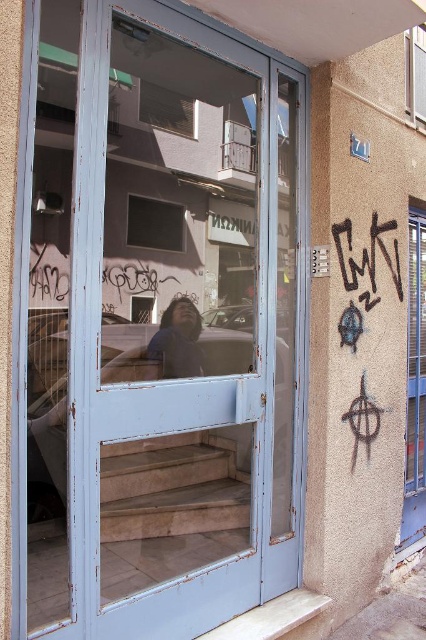
Does black graffiti at upper right have a greater width compared to clear glass window at upper right?

Yes.

Measure the distance from black graffiti at upper right to clear glass window at upper right.

A distance of 38.39 inches exists between black graffiti at upper right and clear glass window at upper right.

Find the location of a particular element. This screenshot has height=640, width=426. black graffiti at upper right is located at coordinates (367, 253).

At what (x,y) coordinates should I click in order to perform the action: click on black graffiti at upper right. Please return your answer as a coordinate pair (x, y). The width and height of the screenshot is (426, 640). Looking at the image, I should click on (367, 253).

Does point (196, 332) lie behind point (166, 224)?

Yes, point (196, 332) is farther from viewer.

Is dark brown hair at center positioned before matte glass window at center?

No, it is behind matte glass window at center.

Is point (158, 330) positioned before point (167, 236)?

No, it is behind (167, 236).

Where is `dark brown hair at center`? dark brown hair at center is located at coordinates (178, 340).

Can you confirm if dark brown hair at center is wider than clear glass window at upper center?

Correct, the width of dark brown hair at center exceeds that of clear glass window at upper center.

Does dark brown hair at center have a lesser height compared to clear glass window at upper center?

No.

Between point (175, 339) and point (186, 131), which one is positioned in front?

Point (186, 131) is more forward.

At what (x,y) coordinates should I click in order to perform the action: click on dark brown hair at center. Please return your answer as a coordinate pair (x, y). Image resolution: width=426 pixels, height=640 pixels. Looking at the image, I should click on (178, 340).